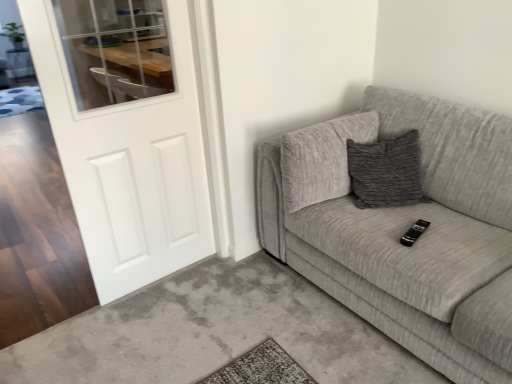
Identify the location of white matte door at left. The height and width of the screenshot is (384, 512). (126, 133).

The height and width of the screenshot is (384, 512). Describe the element at coordinates (414, 232) in the screenshot. I see `black plastic remote at center` at that location.

Image resolution: width=512 pixels, height=384 pixels. In order to click on textured gray couch at right in this screenshot , I will do `click(405, 229)`.

The width and height of the screenshot is (512, 384). Describe the element at coordinates (405, 229) in the screenshot. I see `textured gray couch at right` at that location.

This screenshot has height=384, width=512. Identify the location of white matte door at left. pyautogui.click(x=126, y=133).

Is textured gray couch at right positioned with its back to white matte door at left?

No, textured gray couch at right is not facing away from white matte door at left.

Can you tell me how much textured gray couch at right and white matte door at left differ in facing direction?

textured gray couch at right and white matte door at left are facing 89.4 degrees away from each other.

Between point (373, 320) and point (160, 246), which one is positioned behind?

The point (160, 246) is farther.

Does textured gray couch at right turn towards black plastic remote at center?

Yes, textured gray couch at right is aimed at black plastic remote at center.

Consider the image. How many degrees apart are the facing directions of textured gray couch at right and black plastic remote at center?

13.7 degrees.

Is textured gray couch at right taller than black plastic remote at center?

Indeed, textured gray couch at right has a greater height compared to black plastic remote at center.

Where is `studio couch located in front of the black plastic remote at center`? The image size is (512, 384). studio couch located in front of the black plastic remote at center is located at coordinates (405, 229).

Considering the relative sizes of white matte door at left and textured gray couch at right in the image provided, is white matte door at left bigger than textured gray couch at right?

No, white matte door at left is not bigger than textured gray couch at right.

Are white matte door at left and textured gray couch at right beside each other?

They are not placed beside each other.

Is point (88, 114) closer to camera compared to point (460, 250)?

No, it is not.

This screenshot has height=384, width=512. In order to click on door behind the textured gray couch at right in this screenshot , I will do point(126,133).

Considering the relative sizes of black plastic remote at center and white matte door at left in the image provided, is black plastic remote at center smaller than white matte door at left?

Indeed, black plastic remote at center has a smaller size compared to white matte door at left.

Can you tell me how much black plastic remote at center and white matte door at left differ in facing direction?

The facing directions of black plastic remote at center and white matte door at left are 75.7 degrees apart.

From the picture: Can you confirm if black plastic remote at center is positioned to the right of white matte door at left?

Correct, you'll find black plastic remote at center to the right of white matte door at left.

Where is `remote behind the white matte door at left`? remote behind the white matte door at left is located at coordinates (414, 232).

Who is shorter, black plastic remote at center or textured gray couch at right?

With less height is black plastic remote at center.

Where is `remote on the left side of textured gray couch at right`? This screenshot has width=512, height=384. remote on the left side of textured gray couch at right is located at coordinates click(x=414, y=232).

Is textured gray couch at right inside black plastic remote at center?

That's incorrect, textured gray couch at right is not inside black plastic remote at center.

Considering the positions of objects white matte door at left and black plastic remote at center in the image provided, who is behind, white matte door at left or black plastic remote at center?

black plastic remote at center is further from the camera.

From a real-world perspective, which is physically below, white matte door at left or black plastic remote at center?

black plastic remote at center, from a real-world perspective.

Can you confirm if white matte door at left is wider than black plastic remote at center?

No, white matte door at left is not wider than black plastic remote at center.

Could you tell me if white matte door at left is facing black plastic remote at center?

No, white matte door at left does not turn towards black plastic remote at center.

The height and width of the screenshot is (384, 512). Find the location of `studio couch in front of the white matte door at left`. studio couch in front of the white matte door at left is located at coordinates (405, 229).

Locate an element on the screen. This screenshot has width=512, height=384. remote above the textured gray couch at right (from a real-world perspective) is located at coordinates (414, 232).

Which object lies nearer to the anchor point textured gray couch at right, black plastic remote at center or white matte door at left?

black plastic remote at center is positioned closer to the anchor textured gray couch at right.

Looking at the image, which one is located further to black plastic remote at center, white matte door at left or textured gray couch at right?

white matte door at left is positioned further to the anchor black plastic remote at center.

Looking at the image, which one is located further to white matte door at left, textured gray couch at right or black plastic remote at center?

black plastic remote at center is further to white matte door at left.

From the image, which object appears to be nearer to black plastic remote at center, textured gray couch at right or white matte door at left?

The object closer to black plastic remote at center is textured gray couch at right.

Based on the photo, looking at the image, which one is located further to white matte door at left, black plastic remote at center or textured gray couch at right?

black plastic remote at center is further to white matte door at left.

Looking at this image, considering their positions, is white matte door at left positioned closer to textured gray couch at right than black plastic remote at center?

black plastic remote at center.

You are a GUI agent. You are given a task and a screenshot of the screen. Output one action in this format:
    pyautogui.click(x=<x>, y=<y>)
    Task: Click on the remote between white matte door at left and textured gray couch at right in the horizontal direction
    The width and height of the screenshot is (512, 384).
    Given the screenshot: What is the action you would take?
    pyautogui.click(x=414, y=232)